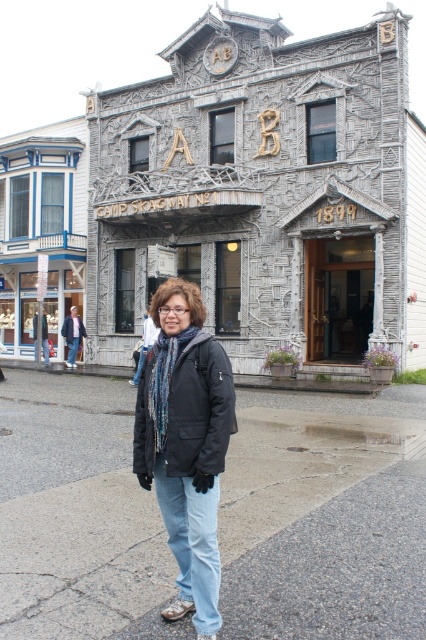
Which of these two, gray stone building at center or black matte jacket at center, stands taller?

Standing taller between the two is gray stone building at center.

Is gray stone building at center positioned before black matte jacket at center?

No, it is behind black matte jacket at center.

Between point (80, 310) and point (186, 420), which one is positioned behind?

The point (80, 310) is behind.

At what (x,y) coordinates should I click in order to perform the action: click on gray stone building at center. Please return your answer as a coordinate pair (x, y). Image resolution: width=426 pixels, height=640 pixels. Looking at the image, I should click on (233, 198).

Is point (178, 332) positioned behind point (146, 417)?

No, (178, 332) is closer to viewer.

Is point (207, 490) behind point (169, 422)?

That is False.

Find the location of a particular element. matte black jacket at center is located at coordinates (186, 444).

Based on the photo, is gray asphalt pavement at lower center positioned before matte black jacket at center?

No.

Can you confirm if gray asphalt pavement at lower center is thinner than matte black jacket at center?

No, gray asphalt pavement at lower center is not thinner than matte black jacket at center.

This screenshot has width=426, height=640. What do you see at coordinates (325, 515) in the screenshot?
I see `gray asphalt pavement at lower center` at bounding box center [325, 515].

Find the location of a particular element. The height and width of the screenshot is (640, 426). gray asphalt pavement at lower center is located at coordinates (325, 515).